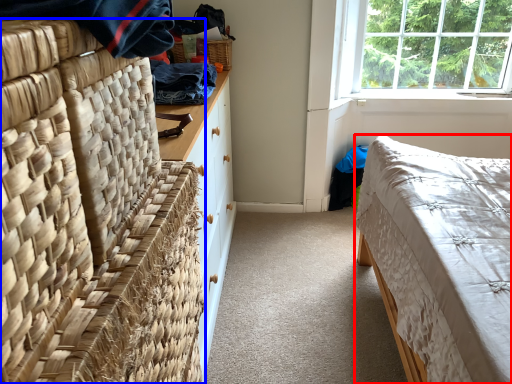
Question: Which object appears closest to the camera in this image, bed (highlighted by a red box) or furniture (highlighted by a blue box)?

Choices:
 (A) bed
 (B) furniture

Answer: (B)